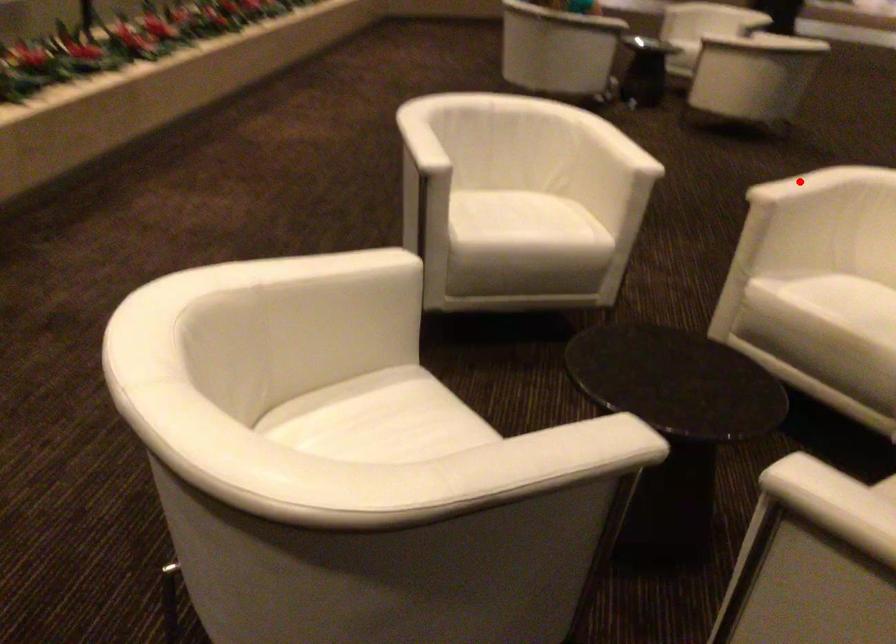
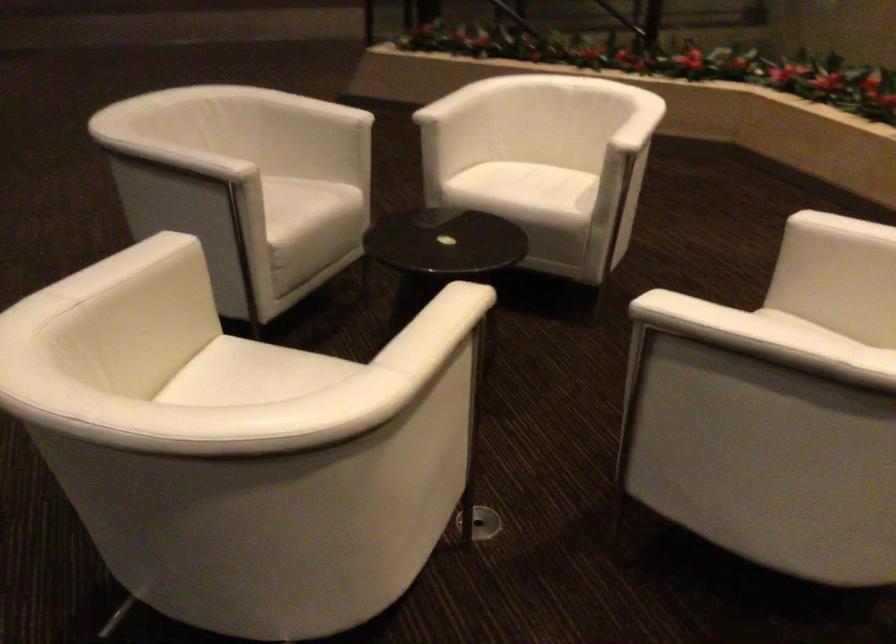
Locate, in the second image, the point that corresponds to the highlighted location in the first image.

(437, 308)